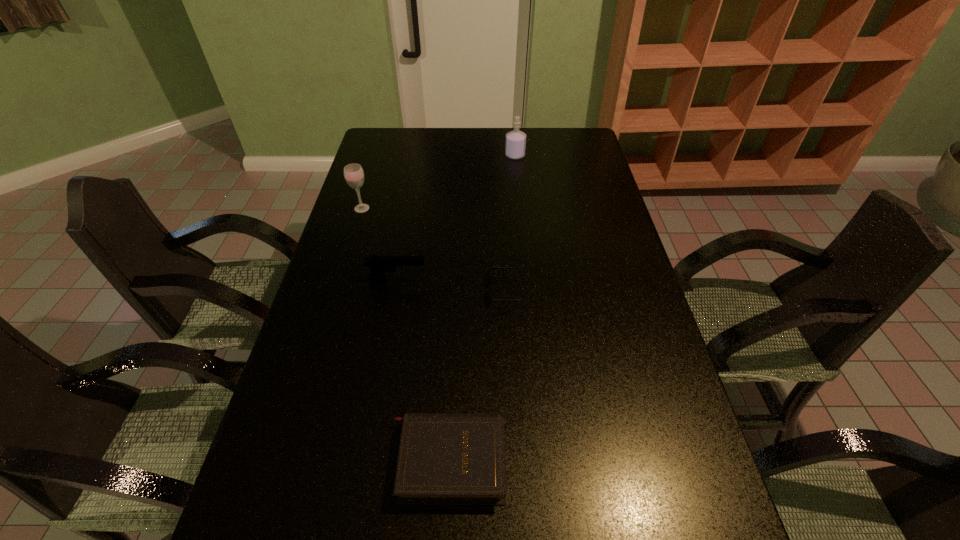
Find the location of `vacant area between the pistol and the perfume`. vacant area between the pistol and the perfume is located at coordinates (456, 218).

In order to click on free space between the sunglasses and the Bible in this screenshot , I will do `click(479, 375)`.

Where is `unoccupied area between the wineglass and the third tallest object`? The height and width of the screenshot is (540, 960). unoccupied area between the wineglass and the third tallest object is located at coordinates (379, 244).

Where is `free space between the Bible and the pistol`? free space between the Bible and the pistol is located at coordinates (422, 370).

Image resolution: width=960 pixels, height=540 pixels. In order to click on vacant area between the Bible and the pistol in this screenshot , I will do `click(422, 370)`.

Locate an element on the screen. This screenshot has height=540, width=960. free space between the sunglasses and the farthest object is located at coordinates (512, 223).

Where is `vacant area that lies between the sunglasses and the wineglass`? This screenshot has width=960, height=540. vacant area that lies between the sunglasses and the wineglass is located at coordinates (435, 249).

Where is `vacant area that lies between the third shortest object and the sunglasses`? vacant area that lies between the third shortest object and the sunglasses is located at coordinates (452, 285).

This screenshot has width=960, height=540. What are the coordinates of `free spot between the farthest object and the leftmost object` in the screenshot? It's located at (439, 182).

Find the location of a particular element. The height and width of the screenshot is (540, 960). object identified as the third closest to the fourth nearest object is located at coordinates pos(515,145).